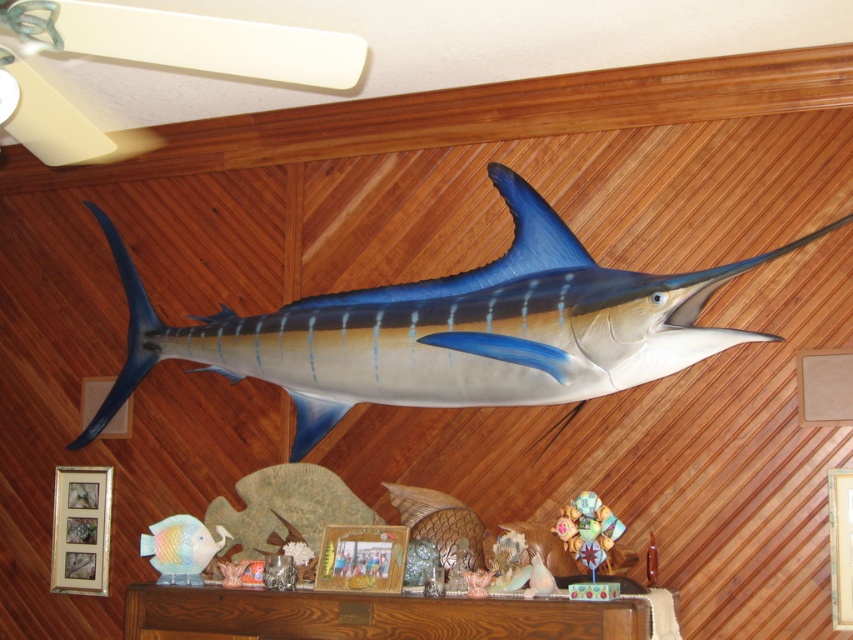
From the picture: Does shiny blue fish at center have a lesser width compared to pastel ceramic fish at lower left?

No.

Who is higher up, shiny blue fish at center or pastel ceramic fish at lower left?

shiny blue fish at center is higher up.

Where is `shiny blue fish at center`? The width and height of the screenshot is (853, 640). shiny blue fish at center is located at coordinates (450, 330).